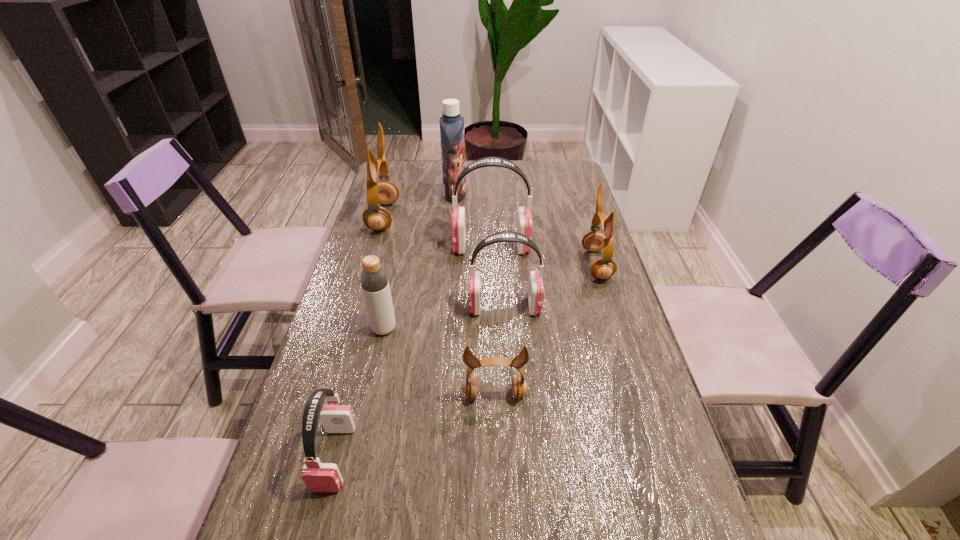
Where is `the nearest brown earphone`? The width and height of the screenshot is (960, 540). the nearest brown earphone is located at coordinates point(469,387).

The image size is (960, 540). Identify the location of the second nearest earphone. (469, 387).

Locate an element on the screen. the nearest earphone is located at coordinates (318, 477).

The height and width of the screenshot is (540, 960). Find the location of `the smallest pink earphone`. the smallest pink earphone is located at coordinates (318, 477).

At what (x,y) coordinates should I click in order to perform the action: click on free location located on the front label of the shampoo. Please return your answer as a coordinate pair (x, y). The height and width of the screenshot is (540, 960). Looking at the image, I should click on (564, 194).

You are a GUI agent. You are given a task and a screenshot of the screen. Output one action in this format:
    pyautogui.click(x=<x>, y=<y>)
    Task: Click on the vacant space located 0.390m on the front-facing side of the leftmost brown earphone
    This screenshot has width=960, height=540.
    Given the screenshot: What is the action you would take?
    pyautogui.click(x=509, y=217)

Image resolution: width=960 pixels, height=540 pixels. I want to click on free location located on the outer surface of the biggest pink earphone, so click(403, 247).

In order to click on free region located 0.280m on the outer surface of the biggest pink earphone in this screenshot , I will do `click(366, 247)`.

Where is `vacant position located on the outer surface of the biggest pink earphone`? vacant position located on the outer surface of the biggest pink earphone is located at coordinates (360, 247).

Image resolution: width=960 pixels, height=540 pixels. I want to click on vacant area situated on the front-facing side of the rightmost brown earphone, so click(518, 265).